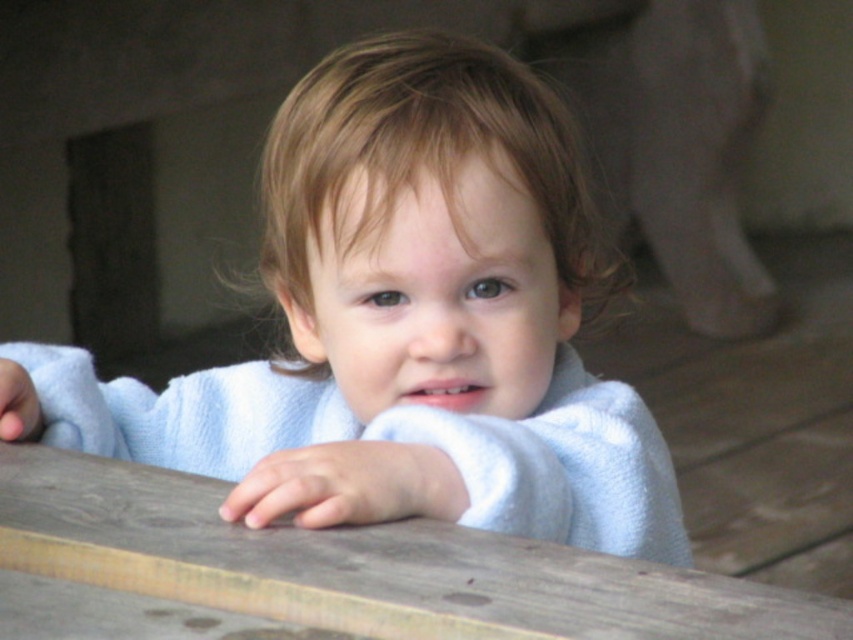
Can you confirm if wooden table at center is positioned to the left of white fluffy robe at center?

Indeed, wooden table at center is positioned on the left side of white fluffy robe at center.

Does wooden table at center have a lesser height compared to white fluffy robe at center?

Yes, wooden table at center is shorter than white fluffy robe at center.

Does point (757, 604) lie in front of point (563, 358)?

That is True.

What are the coordinates of `wooden table at center` in the screenshot? It's located at (364, 566).

Between point (583, 456) and point (589, 532), which one is positioned in front?

Point (589, 532)

Based on the photo, does white soft towel at center appear on the left side of white fluffy robe at center?

Incorrect, white soft towel at center is not on the left side of white fluffy robe at center.

Does point (300, 400) lie behind point (674, 547)?

Yes, it is behind point (674, 547).

The height and width of the screenshot is (640, 853). In order to click on white soft towel at center in this screenshot , I will do `click(402, 324)`.

Who is positioned more to the left, white soft towel at center or wooden table at center?

Answer: wooden table at center is more to the left.

Which is in front, point (538, 180) or point (132, 532)?

Point (132, 532) is in front.

In order to click on white soft towel at center in this screenshot , I will do `click(402, 324)`.